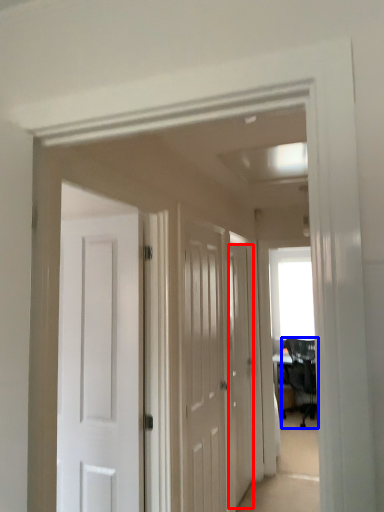
Question: Among these objects, which one is farthest to the camera, door (highlighted by a red box) or chair (highlighted by a blue box)?

Choices:
 (A) door
 (B) chair

Answer: (B)